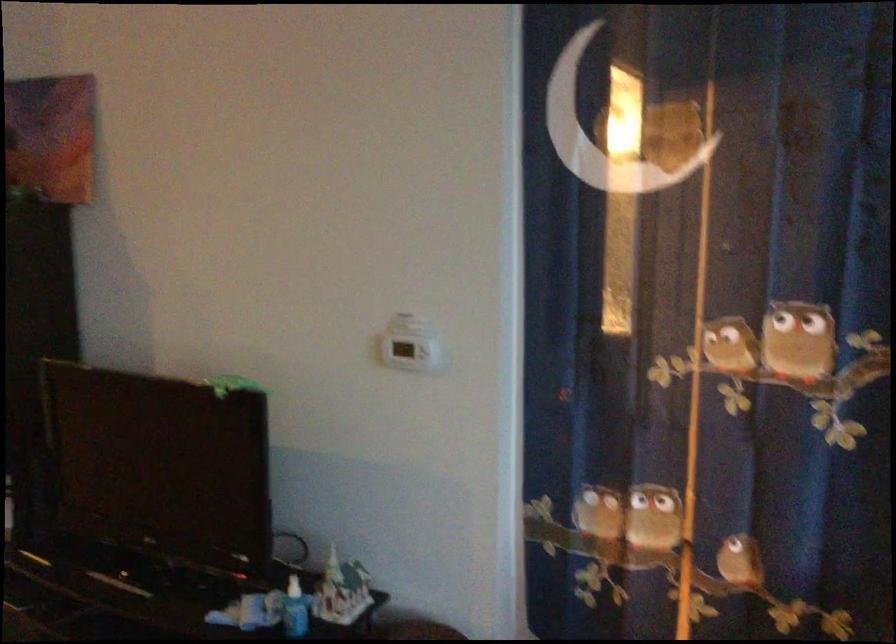
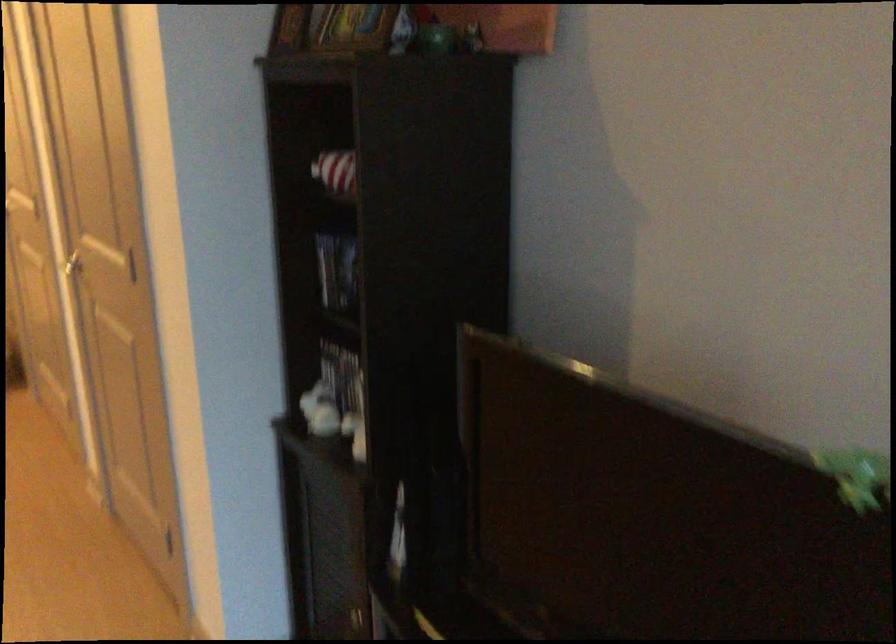
The images are taken continuously from a first-person perspective. In which direction are you moving?

The movement direction of the cameraman is left, forward.